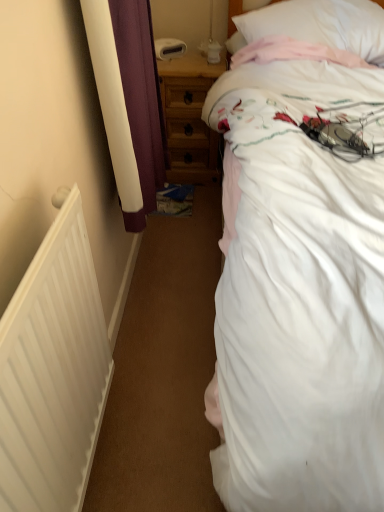
Question: Is wooden nightstand at center situated inside white matte radiator at left or outside?

Choices:
 (A) outside
 (B) inside

Answer: (A)

Question: From a real-world perspective, is wooden nightstand at center above or below white matte radiator at left?

Choices:
 (A) below
 (B) above

Answer: (A)

Question: Estimate the real-world distances between objects in this image. Which object is closer to the white matte radiator at left?

Choices:
 (A) wooden nightstand at center
 (B) white soft pillow at upper right
 (C) white cotton bed at upper right

Answer: (C)

Question: Which object is the farthest from the white soft pillow at upper right?

Choices:
 (A) white matte radiator at left
 (B) white cotton bed at upper right
 (C) wooden nightstand at center

Answer: (A)